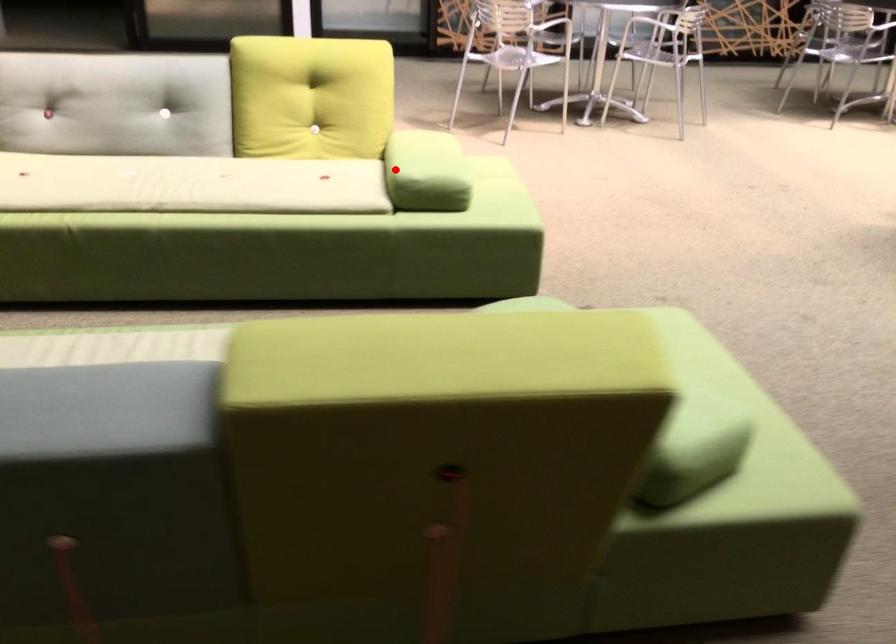
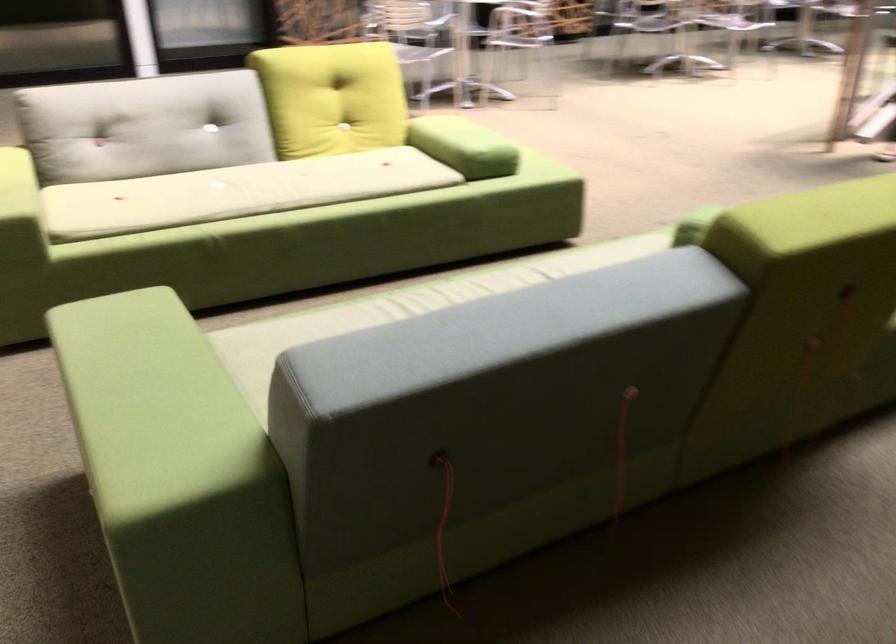
In the second image, find the point that corresponds to the highlighted location in the first image.

(464, 146)